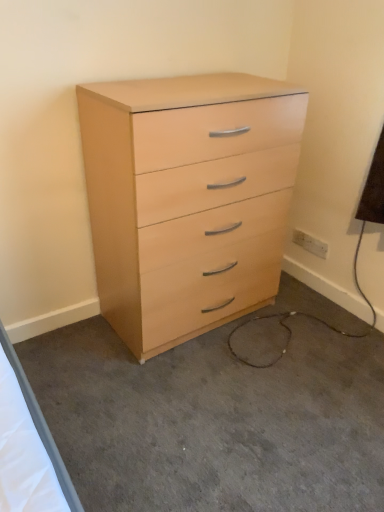
Question: Is light wood/finish chest of drawers at center taller than white plastic electric outlet at lower right?

Choices:
 (A) yes
 (B) no

Answer: (A)

Question: Could you tell me if light wood/finish chest of drawers at center is turned towards white plastic electric outlet at lower right?

Choices:
 (A) yes
 (B) no

Answer: (B)

Question: Is light wood/finish chest of drawers at center far away from white plastic electric outlet at lower right?

Choices:
 (A) no
 (B) yes

Answer: (A)

Question: Is light wood/finish chest of drawers at center at the right side of white plastic electric outlet at lower right?

Choices:
 (A) yes
 (B) no

Answer: (B)

Question: From the image's perspective, is light wood/finish chest of drawers at center beneath white plastic electric outlet at lower right?

Choices:
 (A) no
 (B) yes

Answer: (A)

Question: Considering the relative sizes of light wood/finish chest of drawers at center and white plastic electric outlet at lower right in the image provided, is light wood/finish chest of drawers at center bigger than white plastic electric outlet at lower right?

Choices:
 (A) yes
 (B) no

Answer: (A)

Question: Does white plastic electric outlet at lower right touch light wood dresser at center?

Choices:
 (A) no
 (B) yes

Answer: (A)

Question: From a real-world perspective, is white plastic electric outlet at lower right beneath light wood dresser at center?

Choices:
 (A) no
 (B) yes

Answer: (A)

Question: Is white plastic electric outlet at lower right shorter than light wood dresser at center?

Choices:
 (A) no
 (B) yes

Answer: (A)

Question: Does white plastic electric outlet at lower right have a greater height compared to light wood dresser at center?

Choices:
 (A) yes
 (B) no

Answer: (A)

Question: Does white plastic electric outlet at lower right lie behind light wood dresser at center?

Choices:
 (A) no
 (B) yes

Answer: (B)

Question: From the image's perspective, is white plastic electric outlet at lower right beneath light wood dresser at center?

Choices:
 (A) yes
 (B) no

Answer: (B)

Question: From a real-world perspective, does light wood dresser at center sit lower than white plastic electric outlet at lower right?

Choices:
 (A) no
 (B) yes

Answer: (B)